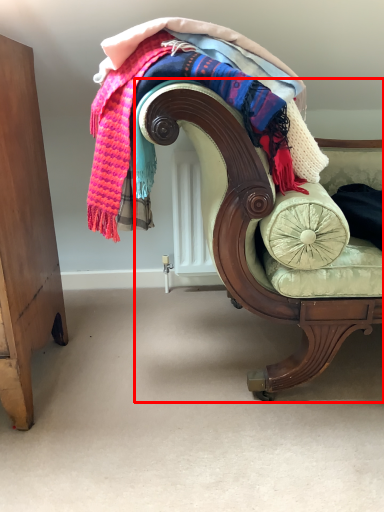
Question: From the image's perspective, what is the correct spatial positioning of chair (annotated by the red box) in reference to laundry?

Choices:
 (A) below
 (B) above

Answer: (A)